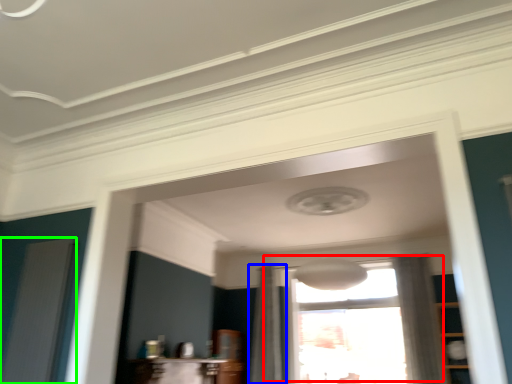
Question: Which object is the closest to the window (highlighted by a red box)? Choose among these: curtain (highlighted by a blue box) or screen door (highlighted by a green box).

Choices:
 (A) curtain
 (B) screen door

Answer: (A)